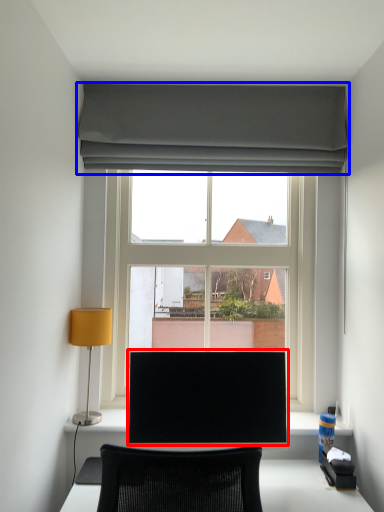
Question: Which point is further to the camera, computer monitor (highlighted by a red box) or curtain (highlighted by a blue box)?

Choices:
 (A) computer monitor
 (B) curtain

Answer: (B)